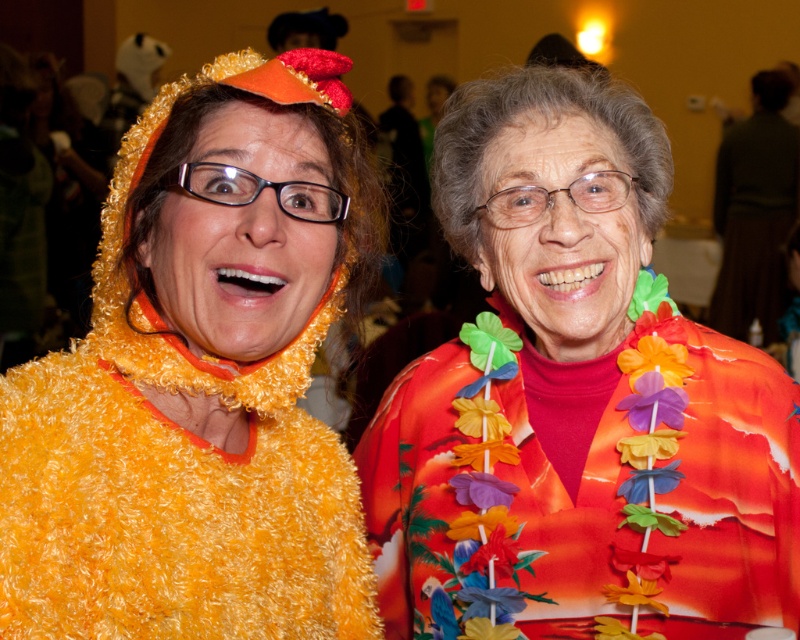
You are standing in front of the scene and want to take a photo of both the fuzzy yellow costume at left and the floral fabric lei at center. Which object will appear larger in the photo?

The fuzzy yellow costume at left will appear larger in the photo because it is closer to the viewer than the floral fabric lei at center.

You are planning to take a photo of the fuzzy yellow costume at left and the floral fabric lei at center. Based on their positions, which object should you focus on first to ensure both are in frame?

The fuzzy yellow costume at left is positioned over the floral fabric lei at center, so you should focus on the fuzzy yellow costume at left first to ensure both are in frame.